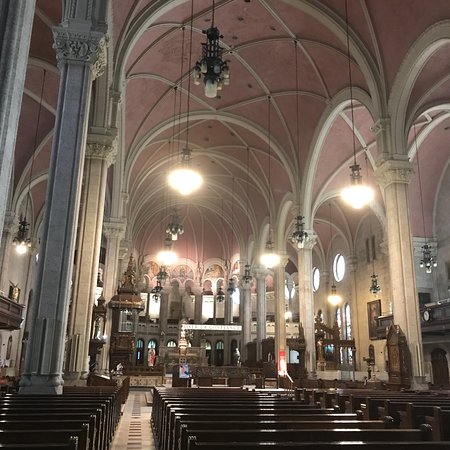
The height and width of the screenshot is (450, 450). I want to click on lecturn, so click(181, 374).